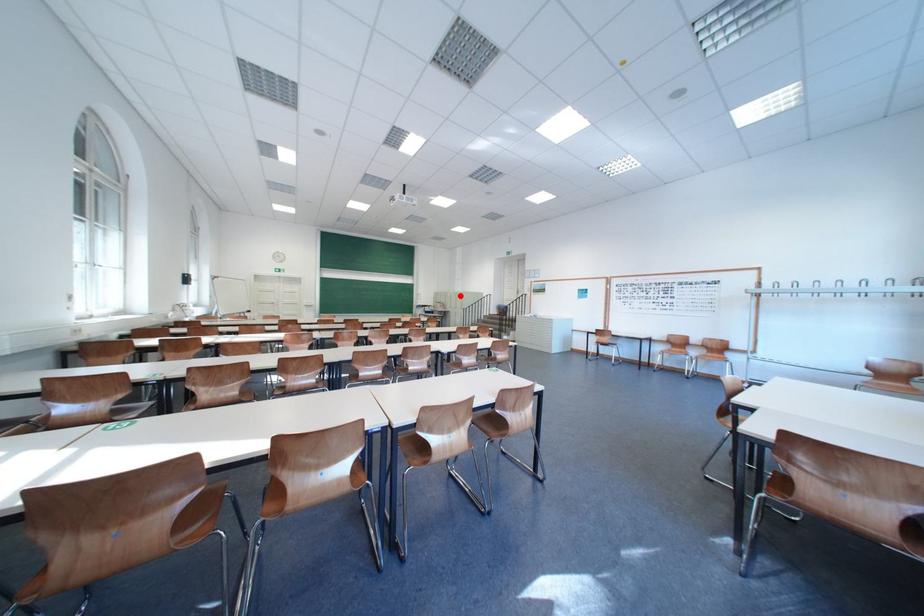
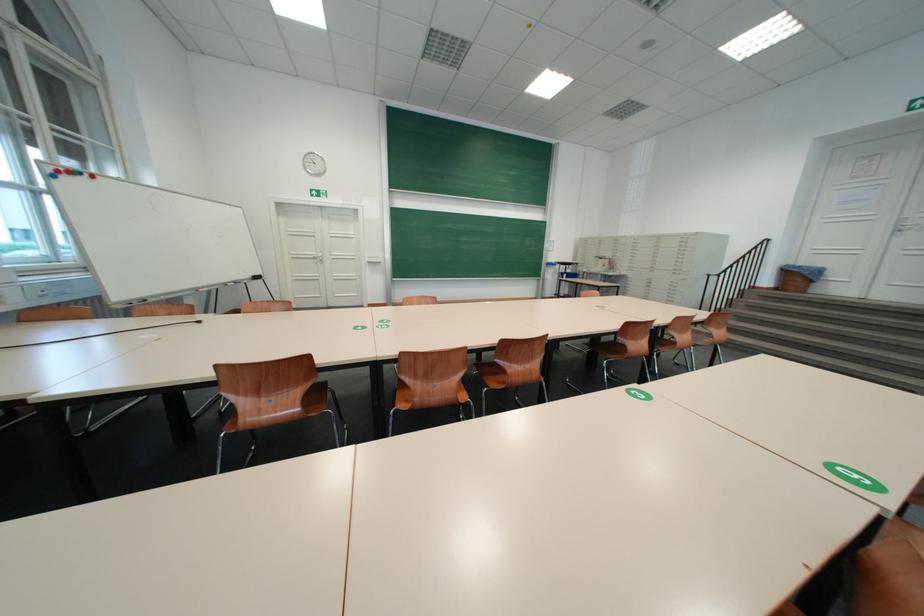
Question: I am providing you with two images of the same scene from different viewpoints. Given a red point in image1, look at the same physical point in image2. Is it:

Choices:
 (A) Closer to the viewpoint
 (B) Farther from the viewpoint

Answer: (A)